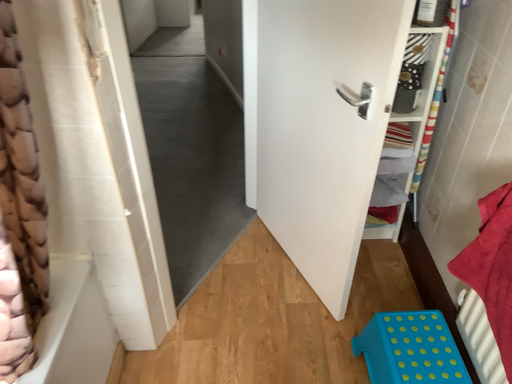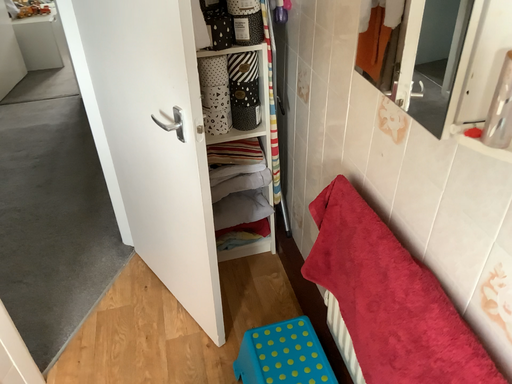
Question: How did the camera likely rotate when shooting the video?

Choices:
 (A) rotated left
 (B) rotated right

Answer: (B)